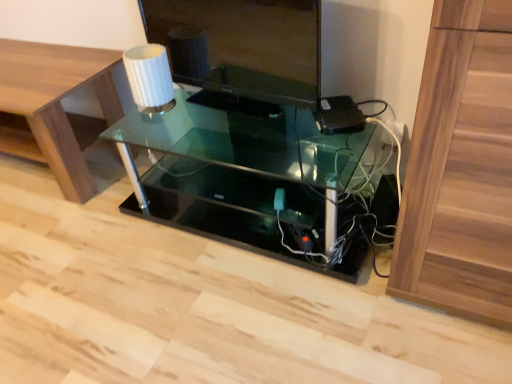
Identify the location of matte black monitor at center. The height and width of the screenshot is (384, 512). (247, 45).

Locate an element on the screen. This screenshot has width=512, height=384. transparent glass table at center is located at coordinates (243, 178).

In the scene shown: Is matte black monitor at center facing away from white ribbed glass at upper center?

Absolutely, matte black monitor at center is directed away from white ribbed glass at upper center.

From their relative heights in the image, would you say matte black monitor at center is taller or shorter than white ribbed glass at upper center?

In the image, matte black monitor at center appears to be taller than white ribbed glass at upper center.

Considering the positions of point (278, 70) and point (138, 101), is point (278, 70) closer or farther from the camera than point (138, 101)?

Point (278, 70) appears to be closer to the viewer than point (138, 101).

Considering the positions of objects matte black monitor at center and white ribbed glass at upper center in the image provided, who is more to the left, matte black monitor at center or white ribbed glass at upper center?

white ribbed glass at upper center.

Is white ribbed glass at upper center far from matte black monitor at center?

They are positioned close to each other.

Choose the correct answer: Is white ribbed glass at upper center inside matte black monitor at center or outside it?

white ribbed glass at upper center is spatially situated outside matte black monitor at center.

Does white ribbed glass at upper center turn towards matte black monitor at center?

No, white ribbed glass at upper center is not aimed at matte black monitor at center.

Does wooden table at lower left have a greater width compared to matte black monitor at center?

Correct, the width of wooden table at lower left exceeds that of matte black monitor at center.

Considering the positions of objects wooden table at lower left and matte black monitor at center in the image provided, who is behind, wooden table at lower left or matte black monitor at center?

wooden table at lower left is further away from the camera.

From the image's perspective, who appears lower, wooden table at lower left or matte black monitor at center?

wooden table at lower left.

Is transparent glass table at center to the left or to the right of white ribbed glass at upper center in the image?

Based on their positions, transparent glass table at center is located to the right of white ribbed glass at upper center.

Is transparent glass table at center oriented away from white ribbed glass at upper center?

No, transparent glass table at center is not facing away from white ribbed glass at upper center.

Do you think transparent glass table at center is within white ribbed glass at upper center, or outside of it?

transparent glass table at center lies outside white ribbed glass at upper center.

From the picture: What's the angular difference between transparent glass table at center and matte black monitor at center's facing directions?

9.82 degrees separate the facing orientations of transparent glass table at center and matte black monitor at center.

Considering the relative positions of transparent glass table at center and matte black monitor at center in the image provided, is transparent glass table at center to the right of matte black monitor at center from the viewer's perspective?

Indeed, transparent glass table at center is positioned on the right side of matte black monitor at center.

How far apart are transparent glass table at center and matte black monitor at center?

transparent glass table at center is 12.80 inches away from matte black monitor at center.

Consider the image. Considering the positions of objects transparent glass table at center and matte black monitor at center in the image provided, who is behind, transparent glass table at center or matte black monitor at center?

matte black monitor at center is further from the camera.

Looking at the image, does matte black monitor at center seem bigger or smaller compared to transparent glass table at center?

Clearly, matte black monitor at center is smaller in size than transparent glass table at center.

Locate an element on the screen. This screenshot has height=384, width=512. table on the right of the matte black monitor at center is located at coordinates (243, 178).

Based on the photo, from a real-world perspective, is matte black monitor at center physically located above or below transparent glass table at center?

From a real-world perspective, matte black monitor at center is physically above transparent glass table at center.

Considering the relative sizes of matte black monitor at center and transparent glass table at center in the image provided, is matte black monitor at center thinner than transparent glass table at center?

Yes.

In the image, there is a white ribbed glass at upper center. In order to click on table below it (from a real-world perspective) in this screenshot , I will do `click(243, 178)`.

Is white ribbed glass at upper center far from transparent glass table at center?

No, there isn't a large distance between white ribbed glass at upper center and transparent glass table at center.

Considering their positions, is white ribbed glass at upper center located in front of or behind transparent glass table at center?

In the image, white ribbed glass at upper center appears behind transparent glass table at center.

Locate an element on the screen. table lamp to the left of matte black monitor at center is located at coordinates (150, 78).

Where is `table lamp that is under the matte black monitor at center (from a real-world perspective)`? The height and width of the screenshot is (384, 512). table lamp that is under the matte black monitor at center (from a real-world perspective) is located at coordinates click(x=150, y=78).

Considering their positions, is wooden table at lower left positioned closer to transparent glass table at center than matte black monitor at center?

matte black monitor at center.

Based on their spatial positions, is matte black monitor at center or wooden table at lower left further from transparent glass table at center?

wooden table at lower left lies further to transparent glass table at center than the other object.

Looking at the image, which one is located closer to transparent glass table at center, wooden table at lower left or white ribbed glass at upper center?

Among the two, white ribbed glass at upper center is located nearer to transparent glass table at center.

From the picture: Looking at the image, which one is located further to matte black monitor at center, transparent glass table at center or white ribbed glass at upper center?

transparent glass table at center is further to matte black monitor at center.

Considering their positions, is white ribbed glass at upper center positioned closer to matte black monitor at center than transparent glass table at center?

white ribbed glass at upper center is closer to matte black monitor at center.

Based on their spatial positions, is wooden table at lower left or matte black monitor at center further from white ribbed glass at upper center?

wooden table at lower left is further to white ribbed glass at upper center.

Considering their positions, is white ribbed glass at upper center positioned closer to transparent glass table at center than matte black monitor at center?

matte black monitor at center lies closer to transparent glass table at center than the other object.

Based on their spatial positions, is white ribbed glass at upper center or matte black monitor at center further from wooden table at lower left?

Among the two, matte black monitor at center is located further to wooden table at lower left.

At what (x,y) coordinates should I click in order to perform the action: click on computer monitor situated between wooden table at lower left and transparent glass table at center from left to right. Please return your answer as a coordinate pair (x, y). This screenshot has width=512, height=384. Looking at the image, I should click on (247, 45).

The width and height of the screenshot is (512, 384). I want to click on table lamp between matte black monitor at center and transparent glass table at center from top to bottom, so click(x=150, y=78).

Identify the location of table lamp between wooden table at lower left and matte black monitor at center in the horizontal direction. (150, 78).

You are a GUI agent. You are given a task and a screenshot of the screen. Output one action in this format:
    pyautogui.click(x=<x>, y=<y>)
    Task: Click on the table lamp between wooden table at lower left and transparent glass table at center in the horizontal direction
    
    Given the screenshot: What is the action you would take?
    pyautogui.click(x=150, y=78)